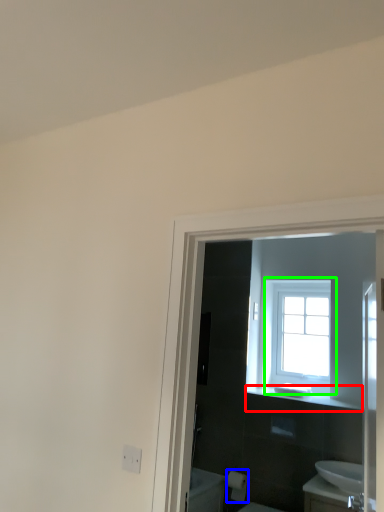
Question: Which object is the closest to the balustrade (highlighted by a red box)? Choose among these: toilet paper (highlighted by a blue box) or window (highlighted by a green box).

Choices:
 (A) toilet paper
 (B) window

Answer: (B)